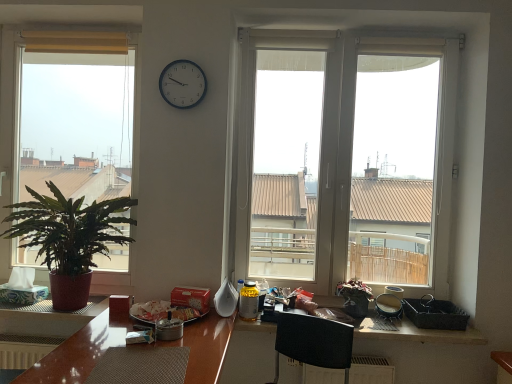
Find the location of a particular element. vacant point above white matte tissue at left (from a real-world perspective) is located at coordinates (23, 264).